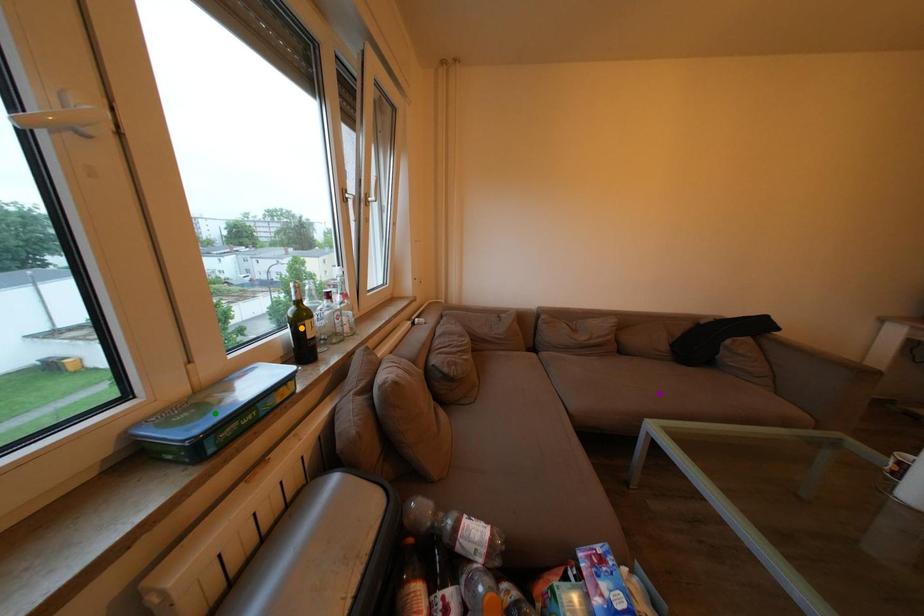
Based on the photo, order these from nearest to farthest:
- orange point
- purple point
- green point

green point, orange point, purple point